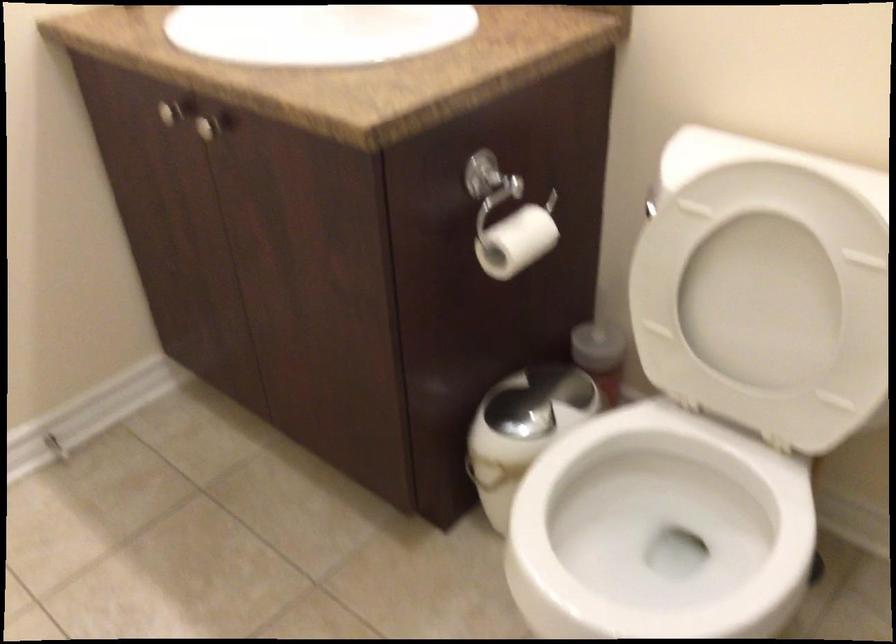
Find where to lift the white toilet lid. Please return your answer as a coordinate pair (x, y).

(763, 299)